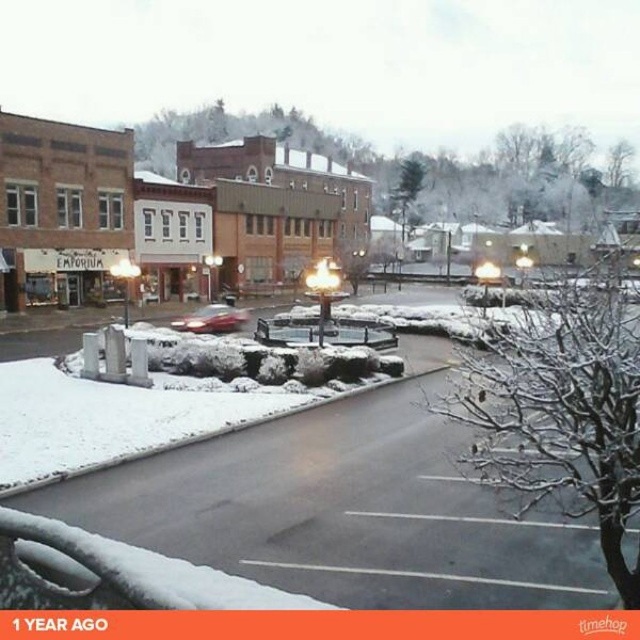
You are a visitor trying to find the entrance to the brick building at center. You see the shiny red car at center parked nearby. Based on the scene description, which side of the car should you look for the entrance?

The entrance to the brick building at center is likely to the left side of the shiny red car at center since the brick building at center is positioned to the left of the shiny red car at center.

Consider the image. You are a delivery person trying to park your shiny red car at center in the snow. Can you safely park the car on the white fluffy snow at center without sinking into the snow?

The white fluffy snow at center is located below the shiny red car at center, which means the car is already parked on top of the snow. Since the snow is supporting the car, it should be safe to park there without sinking.